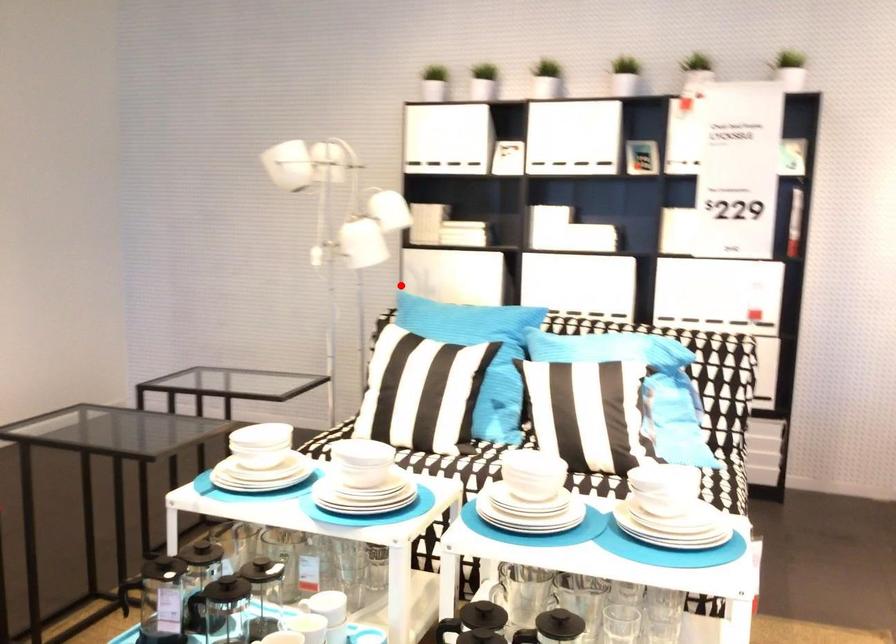
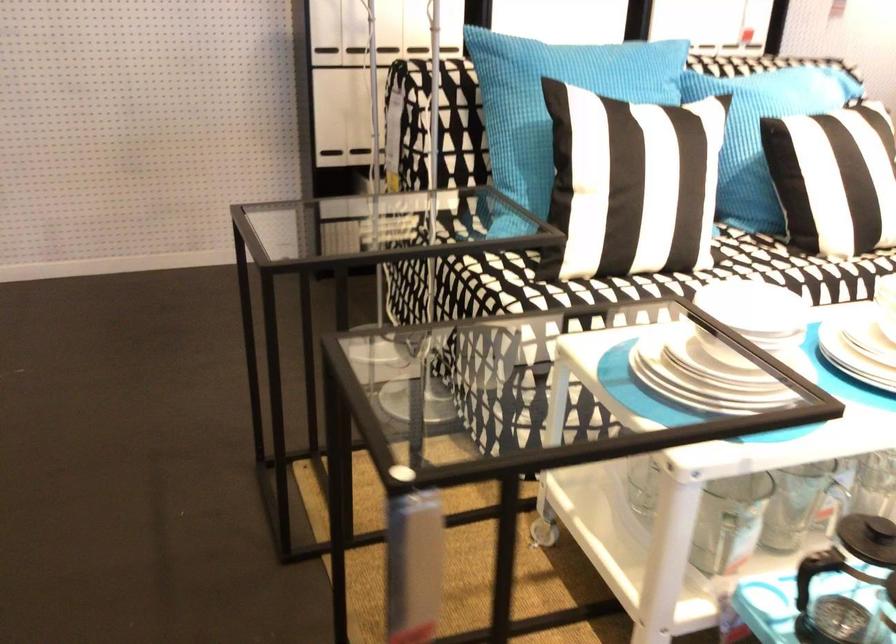
The point at the highlighted location is marked in the first image. Where is the corresponding point in the second image?

(325, 46)